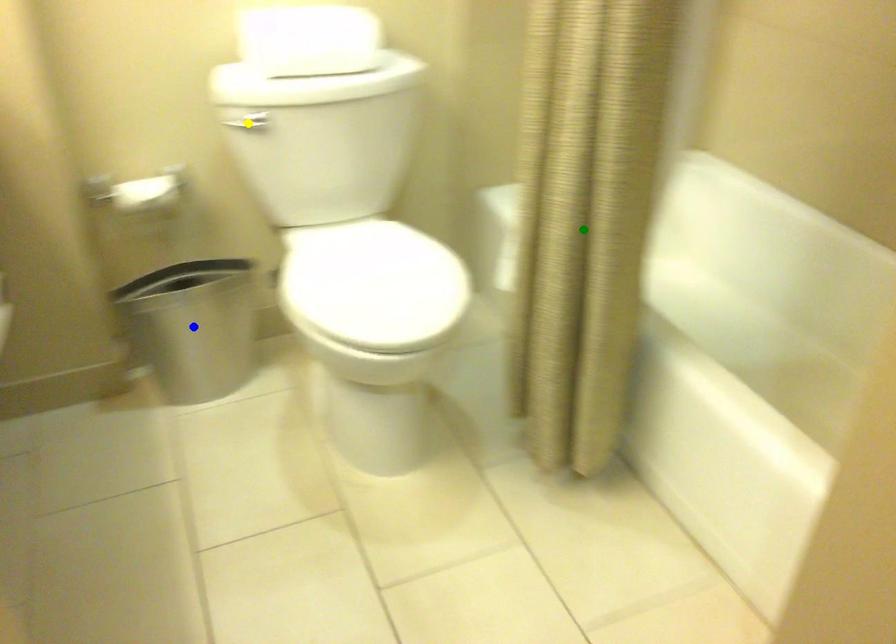
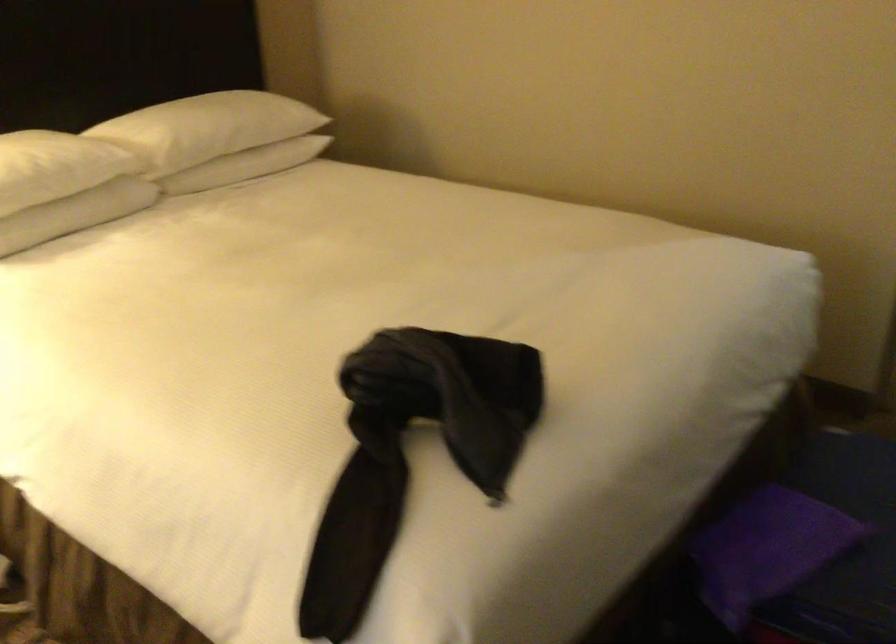
I am providing you with two images of the same scene from different viewpoints. Three points are marked in image1. Which point corresponds to a part or object that is occluded in image2?In image1, three points are marked. Which of them correspond to a part or object that is occluded in image2?Among the three points shown in image1, which one corresponds to a part or object that is no longer visible due to occlusion in image2?

yellow point, green point, blue point